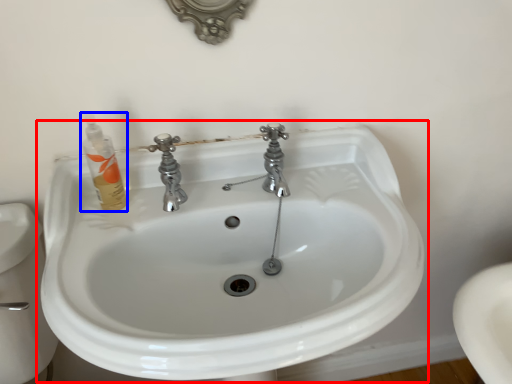
Question: Which point is further to the camera, sink (highlighted by a red box) or toiletry (highlighted by a blue box)?

Choices:
 (A) sink
 (B) toiletry

Answer: (B)